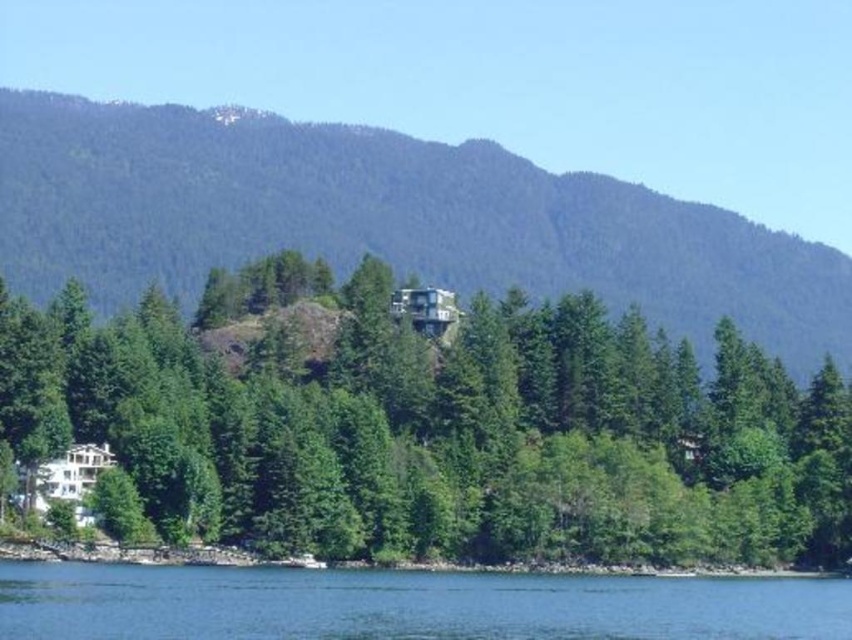
Does green forested mountain at center have a smaller size compared to blue water at lower center?

No.

In the scene shown: Can you confirm if green forested mountain at center is shorter than blue water at lower center?

No, green forested mountain at center is not shorter than blue water at lower center.

At what (x,y) coordinates should I click in order to perform the action: click on green forested mountain at center. Please return your answer as a coordinate pair (x, y). The image size is (852, 640). Looking at the image, I should click on (384, 220).

You are a GUI agent. You are given a task and a screenshot of the screen. Output one action in this format:
    pyautogui.click(x=<x>, y=<y>)
    Task: Click on the green forested mountain at center
    This screenshot has height=640, width=852.
    Given the screenshot: What is the action you would take?
    pyautogui.click(x=384, y=220)

Who is higher up, green matte tree at center or green forested mountain at center?

green forested mountain at center is higher up.

Which is more to the left, green matte tree at center or green forested mountain at center?

Positioned to the left is green forested mountain at center.

Who is more distant from viewer, [285,525] or [809,362]?

The point [809,362] is behind.

Locate an element on the screen. green matte tree at center is located at coordinates (430, 428).

Between green matte tree at center and blue water at lower center, which one has less height?

With less height is blue water at lower center.

Does green matte tree at center have a smaller size compared to blue water at lower center?

Incorrect, green matte tree at center is not smaller in size than blue water at lower center.

Which is in front, point (228, 394) or point (770, 620)?

Positioned in front is point (770, 620).

This screenshot has height=640, width=852. Identify the location of green matte tree at center. (430, 428).